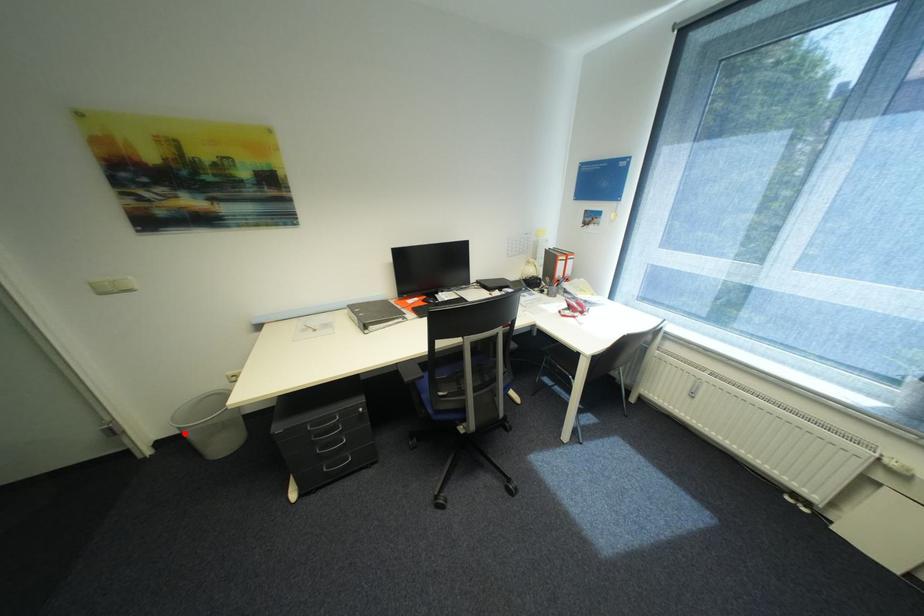
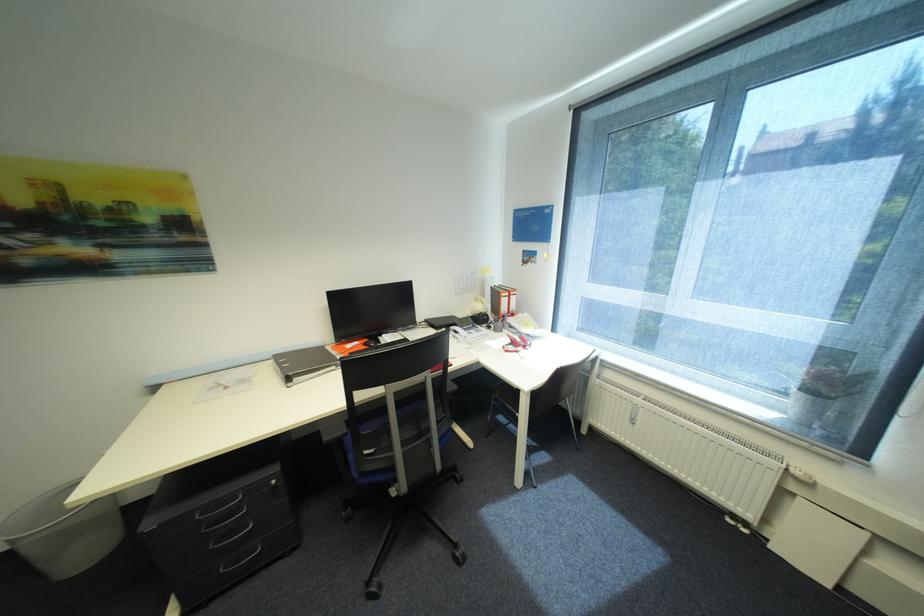
Find the pixel in the second image that matches the highlighted location in the first image.

(14, 548)